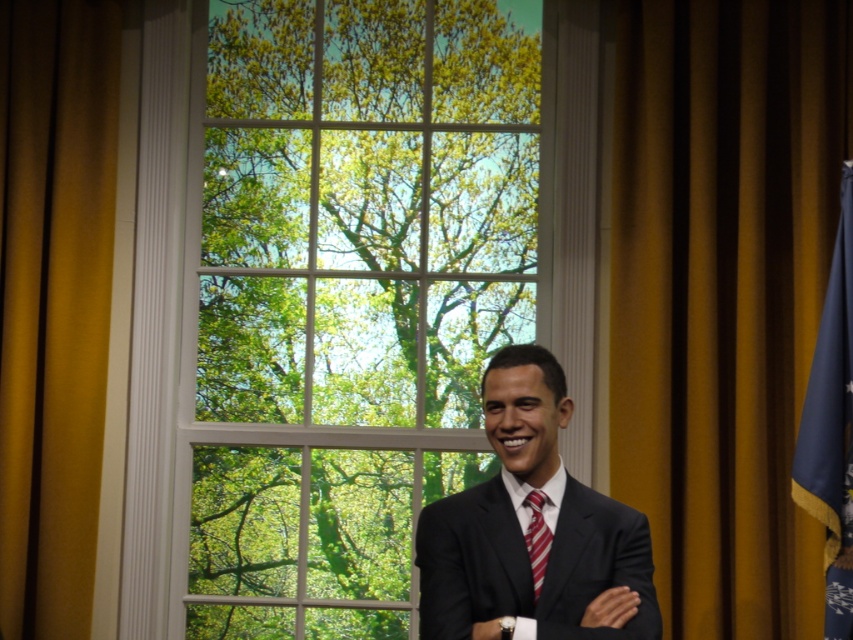
Question: Which object is closer to the camera taking this photo?

Choices:
 (A) gold fabric curtain at right
 (B) white glass window at center
 (C) black matte suit at center

Answer: (C)

Question: Can you confirm if black matte suit at center is positioned above blue fabric flag at right?

Choices:
 (A) yes
 (B) no

Answer: (B)

Question: Does white glass window at center appear on the right side of gold fabric curtain at left?

Choices:
 (A) no
 (B) yes

Answer: (B)

Question: From the image, what is the correct spatial relationship of gold fabric curtain at left in relation to blue fabric flag at right?

Choices:
 (A) above
 (B) below

Answer: (A)

Question: Which object appears farthest from the camera in this image?

Choices:
 (A) black matte suit at center
 (B) gold fabric curtain at right
 (C) gold fabric curtain at left
 (D) striped silk tie at center

Answer: (C)

Question: Which of the following is the farthest from the observer?

Choices:
 (A) (549, 545)
 (B) (840, 547)

Answer: (B)